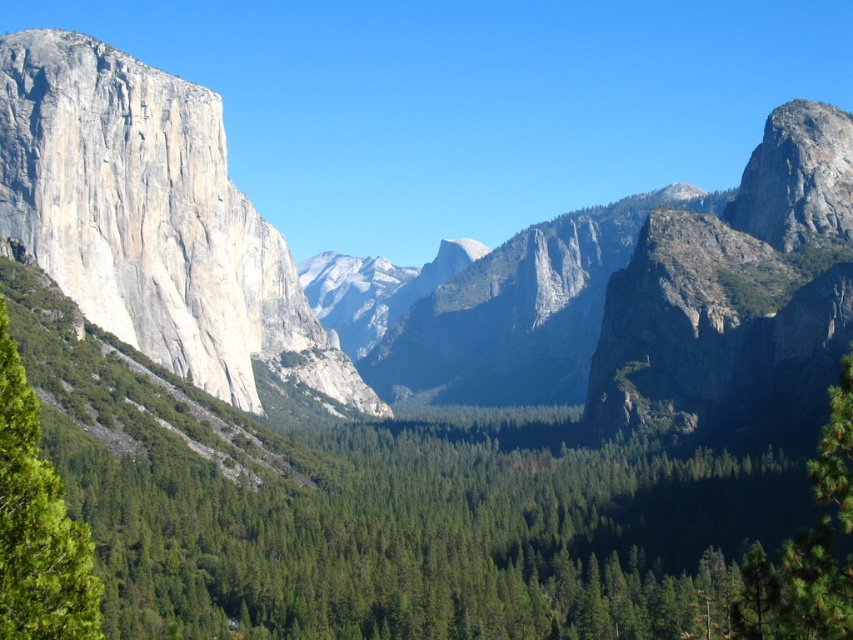
Question: Which object is positioned closest to the gray rock formation at center?

Choices:
 (A) granite cliff face at left
 (B) green leafy tree at left

Answer: (A)

Question: Does gray rock formation at center have a larger size compared to granite cliff face at left?

Choices:
 (A) yes
 (B) no

Answer: (A)

Question: Does gray rock formation at center have a larger size compared to green leafy tree at left?

Choices:
 (A) yes
 (B) no

Answer: (A)

Question: Among these objects, which one is nearest to the camera?

Choices:
 (A) gray rock formation at center
 (B) granite cliff face at left

Answer: (A)

Question: Does granite cliff face at left have a greater width compared to green leafy tree at left?

Choices:
 (A) yes
 (B) no

Answer: (A)

Question: Among these points, which one is nearest to the camera?

Choices:
 (A) (155, 308)
 (B) (126, 60)
 (C) (12, 477)

Answer: (C)